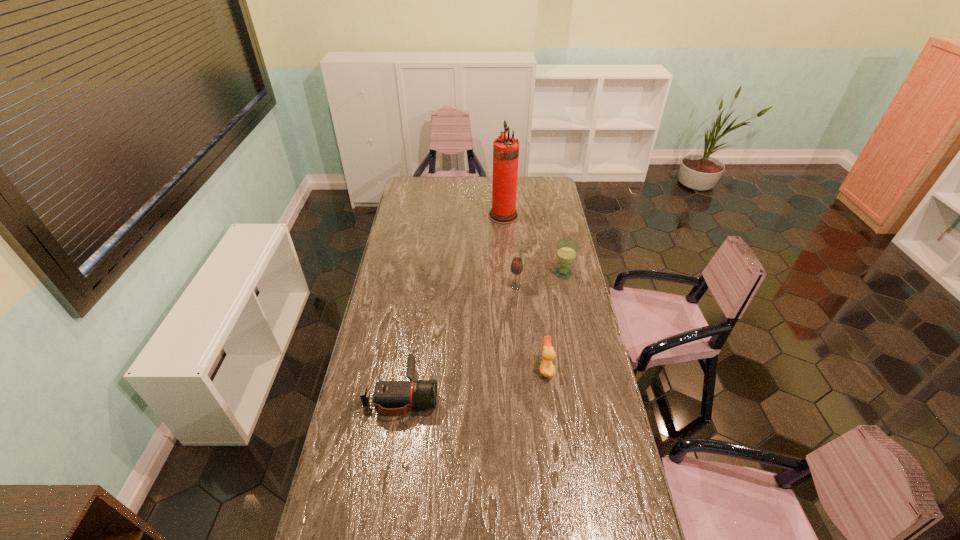
The image size is (960, 540). I want to click on empty location between the farther glass drink container and the fire extinguisher, so click(x=534, y=244).

Where is `free spot between the camcorder and the duck`? free spot between the camcorder and the duck is located at coordinates (474, 381).

The width and height of the screenshot is (960, 540). In order to click on vacant space in between the fourth nearest object and the duck in this screenshot , I will do `click(555, 321)`.

This screenshot has width=960, height=540. I want to click on empty location between the duck and the camcorder, so click(474, 381).

Identify the location of object that ranks as the fourth closest to the rightmost object. The image size is (960, 540). tap(392, 398).

Identify the location of object that stands as the third closest to the fourth nearest object. This screenshot has width=960, height=540. (547, 369).

Find the location of a particular element. This screenshot has width=960, height=540. blank space that satisfies the following two spatial constraints: 1. at the discharge end of the fire extinguisher; 2. on the back side of the nearer glass drink container is located at coordinates (509, 286).

What are the coordinates of `vacant space that satisfies the following two spatial constraints: 1. on the back side of the fourth nearest object; 2. on the right side of the third farthest object` in the screenshot? It's located at (515, 273).

The width and height of the screenshot is (960, 540). In order to click on free space that satisfies the following two spatial constraints: 1. at the discharge end of the fire extinguisher; 2. on the left side of the rightmost object in this screenshot , I will do pyautogui.click(x=508, y=273).

Where is `free spot that satisfies the following two spatial constraints: 1. on the back side of the nearer glass drink container; 2. on the right side of the right glass drink container`? The height and width of the screenshot is (540, 960). free spot that satisfies the following two spatial constraints: 1. on the back side of the nearer glass drink container; 2. on the right side of the right glass drink container is located at coordinates (515, 273).